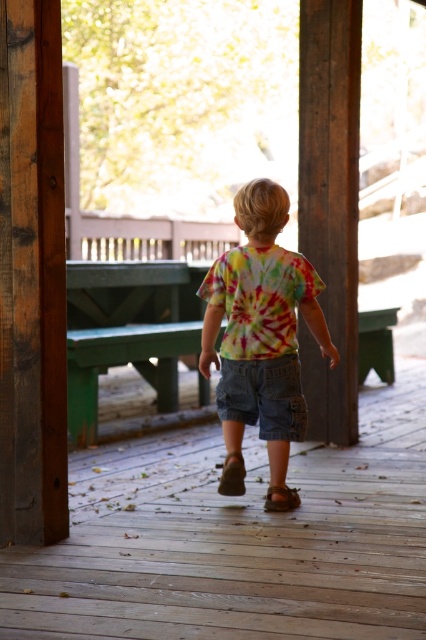
You are a photographer trying to capture the child from behind as they walk towards the wooden deck. Based on the scene, which object between the wooden post at center and the denim shorts at center is taller?

The wooden post at center is taller than the denim shorts at center.

You are standing at point (278, 508) and want to move to point (275, 429). Given that the child is walking towards the bright outdoor area, which direction should you go relative to the child?

Point (275, 429) is behind point (278, 508), so you should go behind the child to reach your destination.